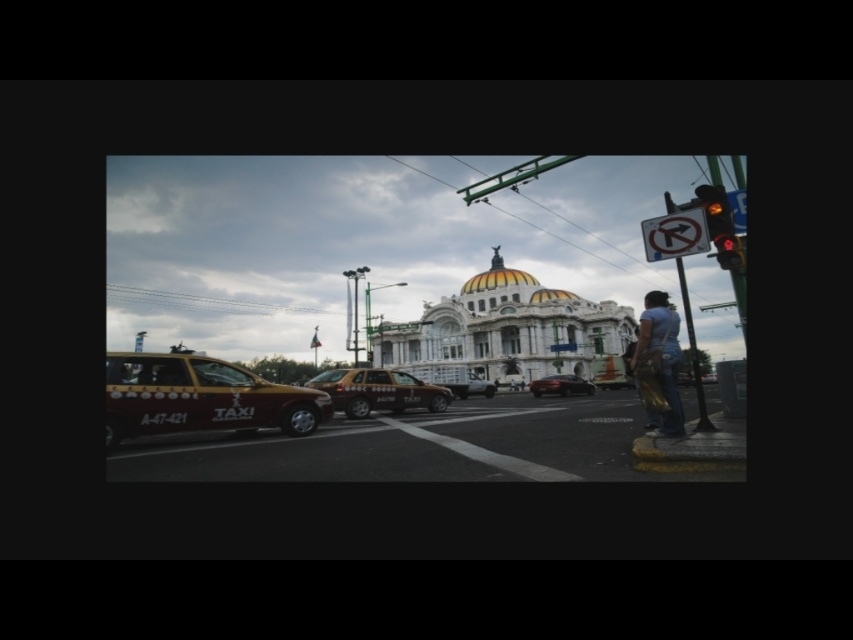
Can you confirm if yellow glossy taxi at left is positioned to the left of metallic silver car at center?

Indeed, yellow glossy taxi at left is positioned on the left side of metallic silver car at center.

Describe the element at coordinates (200, 397) in the screenshot. This screenshot has height=640, width=853. I see `yellow glossy taxi at left` at that location.

Locate an element on the screen. The image size is (853, 640). yellow glossy taxi at left is located at coordinates (200, 397).

Between yellow glossy taxi at left and amber glass traffic light at upper right, which one appears on the left side from the viewer's perspective?

Positioned to the left is yellow glossy taxi at left.

Is yellow glossy taxi at left bigger than amber glass traffic light at upper right?

Incorrect, yellow glossy taxi at left is not larger than amber glass traffic light at upper right.

At what (x,y) coordinates should I click in order to perform the action: click on yellow glossy taxi at left. Please return your answer as a coordinate pair (x, y). This screenshot has width=853, height=640. Looking at the image, I should click on (200, 397).

Find the location of a particular element. yellow glossy taxi at left is located at coordinates (200, 397).

What do you see at coordinates (675, 234) in the screenshot? The image size is (853, 640). I see `white plastic sign at upper right` at bounding box center [675, 234].

Between point (672, 214) and point (489, 268), which one is positioned in front?

Point (672, 214) is more forward.

Is point (682, 236) behind point (521, 275)?

No, it is not.

Where is `white plastic sign at upper right`? The width and height of the screenshot is (853, 640). white plastic sign at upper right is located at coordinates (675, 234).